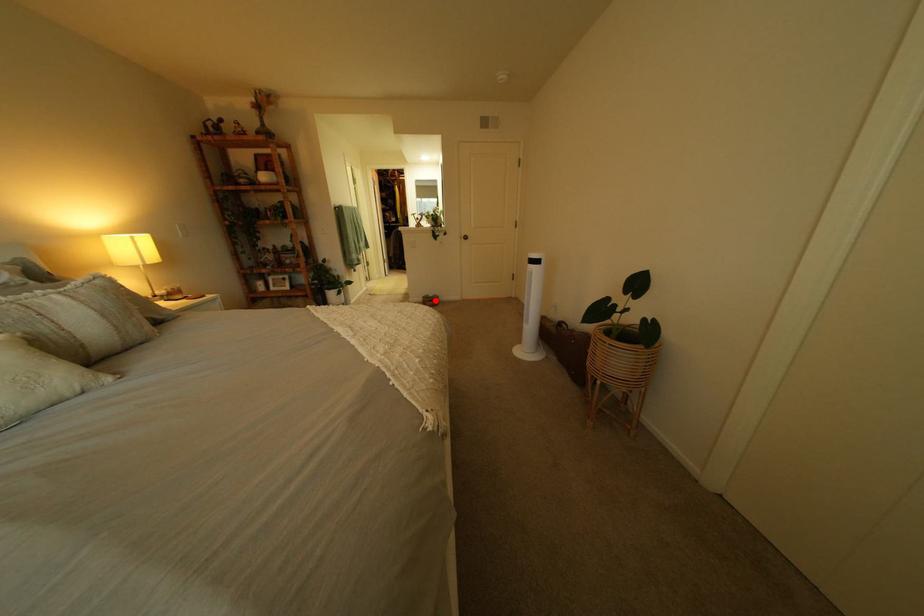
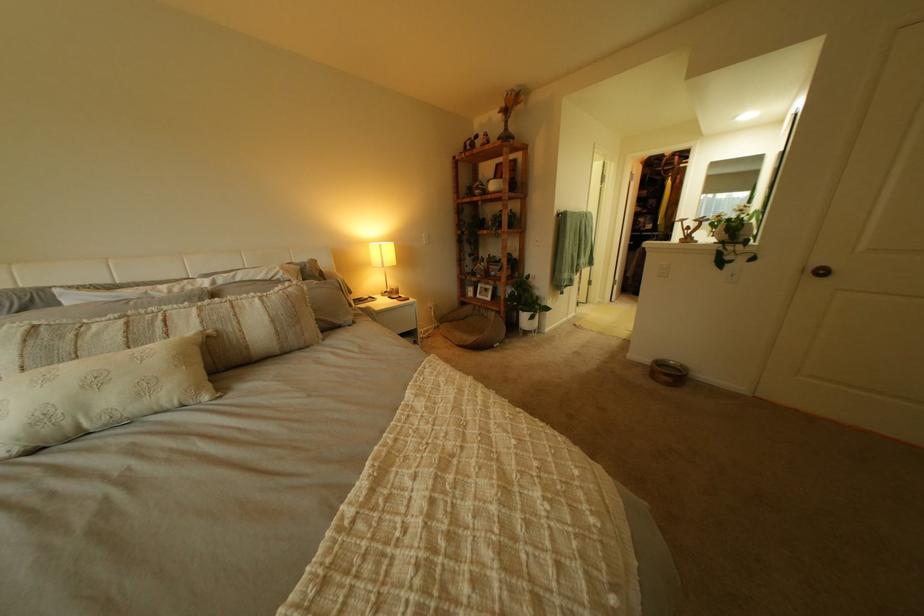
Question: I am providing you with two images of the same scene from different viewpoints. A red point is marked on the first image. At the location where the point appears in image 1, is it still visible in image 2?

Choices:
 (A) Yes
 (B) No

Answer: (A)